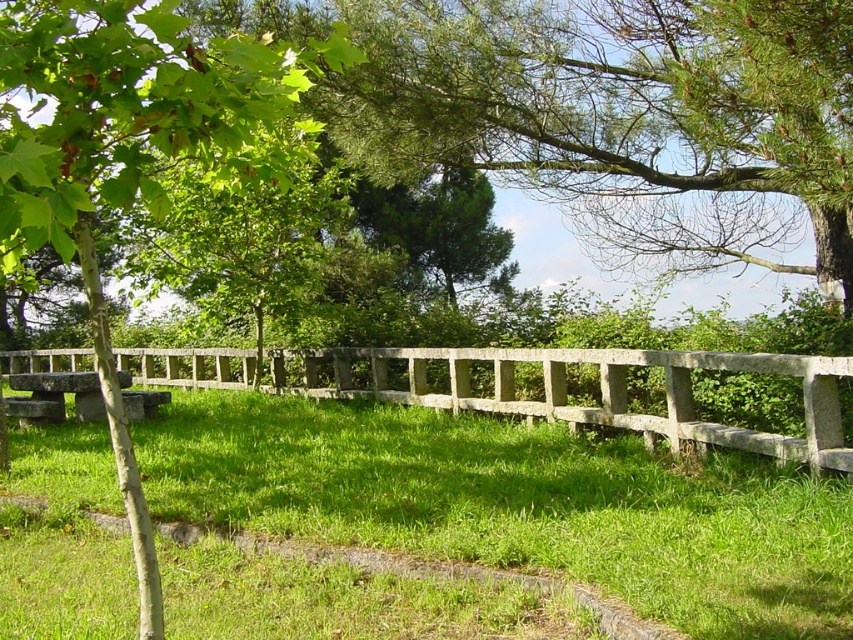
You are sitting on the smooth gray stone bench at left and want to walk to the gray stone fence at center. Which direction should you move to reach it?

You should move to the right because the gray stone fence at center is located to the right of the smooth gray stone bench at left.

From the picture: You are sitting on the smooth gray stone bench at left and want to place a small potted plant on the green grassy at center. In which direction should you move the plant relative to the bench?

You should move the plant to the right relative to the smooth gray stone bench at left because the green grassy at center is located to the right of the bench.

You are sitting on the smooth gray stone bench at left and want to look over the gray stone fence at center to see what is beyond. Can you see over the fence from your current position?

The gray stone fence at center is above the smooth gray stone bench at left, so you cannot see over the fence from your current position because the bench is lower than the fence.